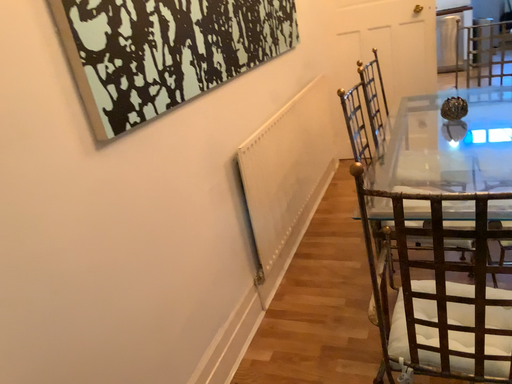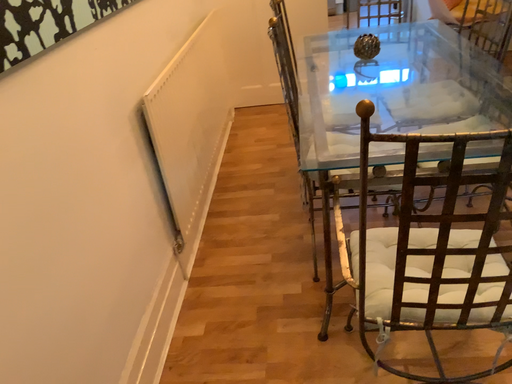
Question: Which way did the camera rotate in the video?

Choices:
 (A) rotated left
 (B) rotated right

Answer: (B)